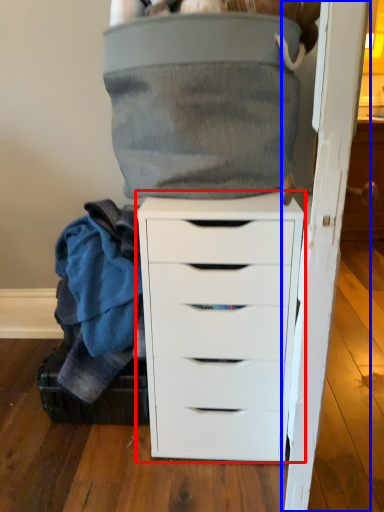
Question: Among these objects, which one is farthest to the camera, chest of drawers (highlighted by a red box) or door (highlighted by a blue box)?

Choices:
 (A) chest of drawers
 (B) door

Answer: (B)